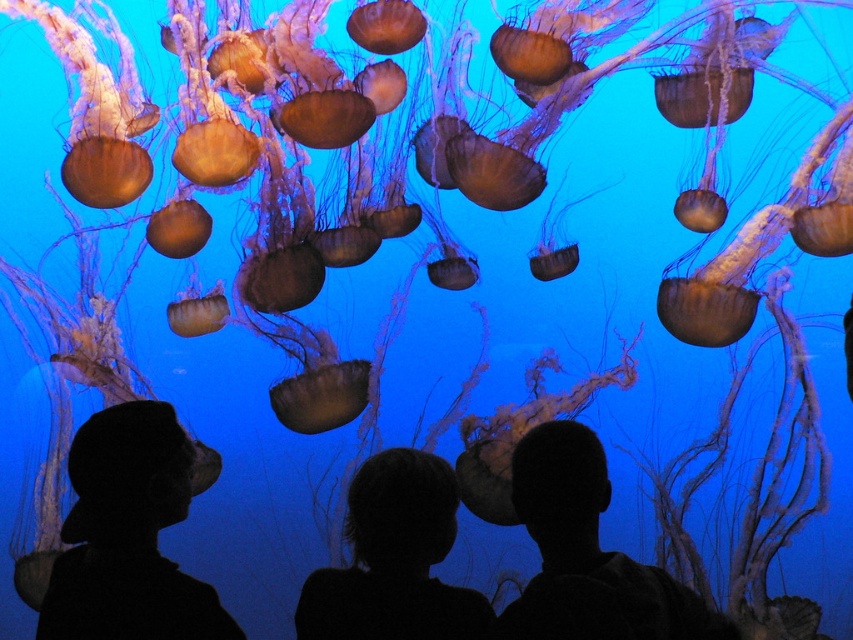
Question: Is silhouette head at center positioned in front of silhouette hair at center?

Choices:
 (A) no
 (B) yes

Answer: (B)

Question: Which object appears closest to the camera in this image?

Choices:
 (A) silhouette head at center
 (B) silhouette hair at center

Answer: (A)

Question: Which of these objects is positioned closest to the silhouette hair at center?

Choices:
 (A) silhouette hat at lower left
 (B) silhouette head at center

Answer: (B)

Question: Which object appears farthest from the camera in this image?

Choices:
 (A) silhouette head at center
 (B) silhouette hat at lower left

Answer: (B)

Question: From the image, what is the correct spatial relationship of silhouette head at center in relation to silhouette hair at center?

Choices:
 (A) left
 (B) right

Answer: (B)

Question: Is silhouette hat at lower left thinner than silhouette hair at center?

Choices:
 (A) no
 (B) yes

Answer: (A)